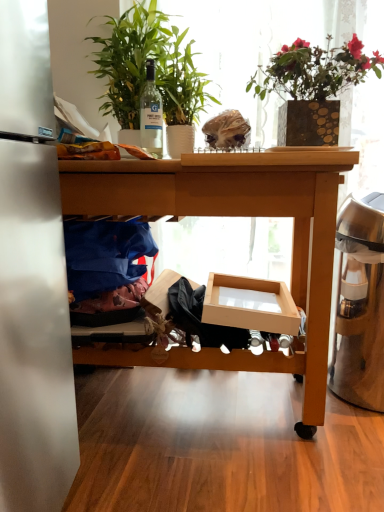
I want to click on free space that is to the left of satin silver trash can at right, so click(x=276, y=401).